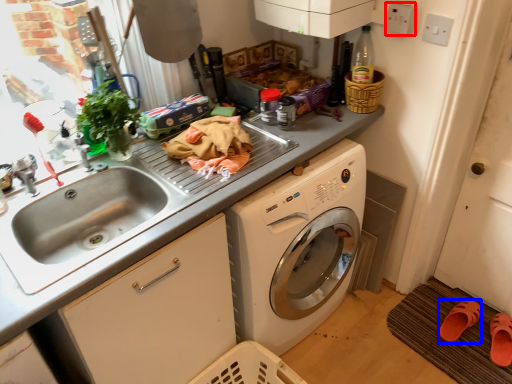
Question: Among these objects, which one is farthest to the camera, electric outlet (highlighted by a red box) or shoe (highlighted by a blue box)?

Choices:
 (A) electric outlet
 (B) shoe

Answer: (B)